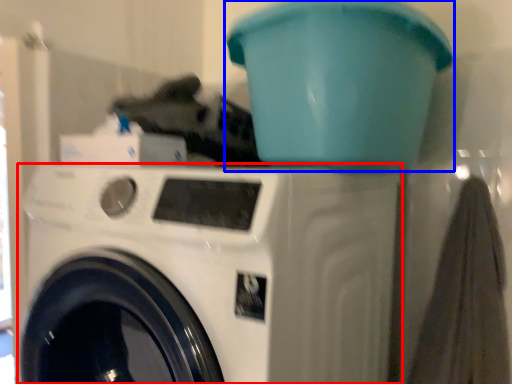
Question: Which object appears closest to the camera in this image, washing machine (highlighted by a red box) or water cooler (highlighted by a blue box)?

Choices:
 (A) washing machine
 (B) water cooler

Answer: (A)